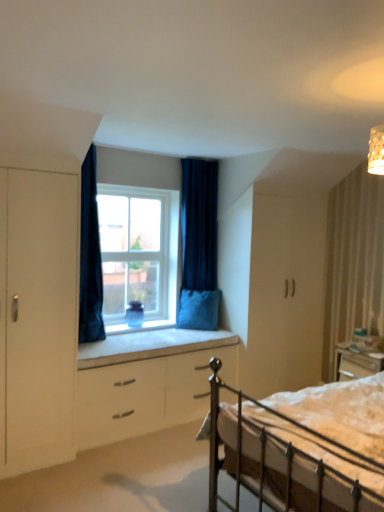
This screenshot has height=512, width=384. In order to click on free space in front of white matte cabinet at left in this screenshot , I will do `click(31, 485)`.